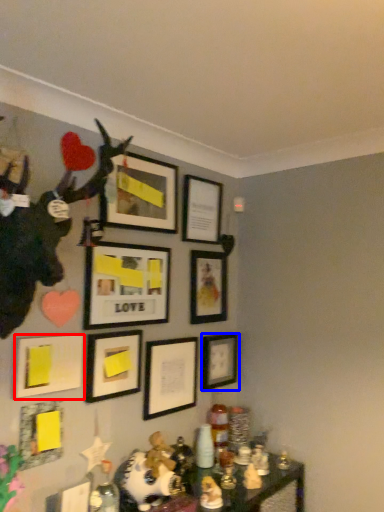
Question: Which object is closer to the camera taking this photo, picture frame (highlighted by a red box) or picture frame (highlighted by a blue box)?

Choices:
 (A) picture frame
 (B) picture frame

Answer: (A)